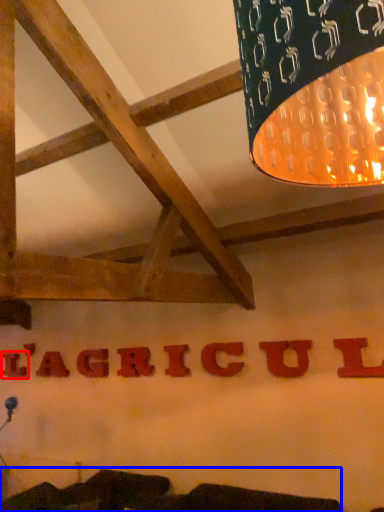
Question: Which point is closer to the camera, letter (highlighted by a red box) or furniture (highlighted by a blue box)?

Choices:
 (A) letter
 (B) furniture

Answer: (B)